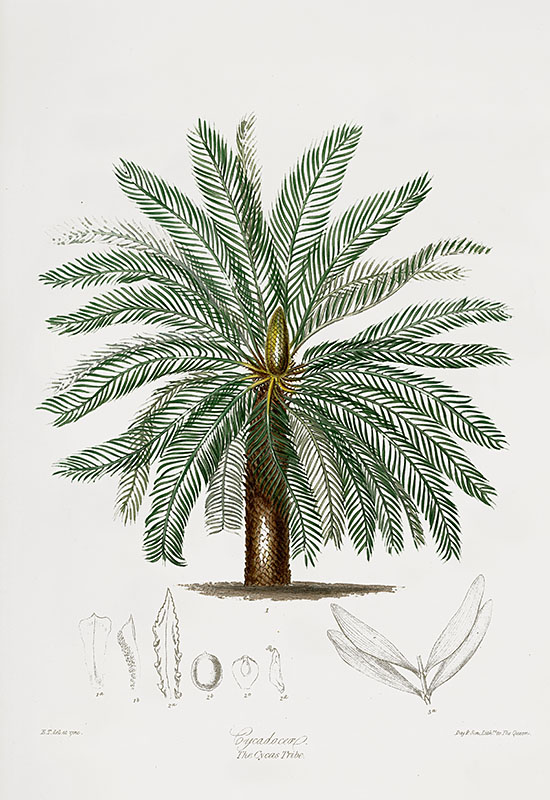
Find the location of `corner`. corner is located at coordinates (536, 778), (23, 781), (13, 34), (532, 14).